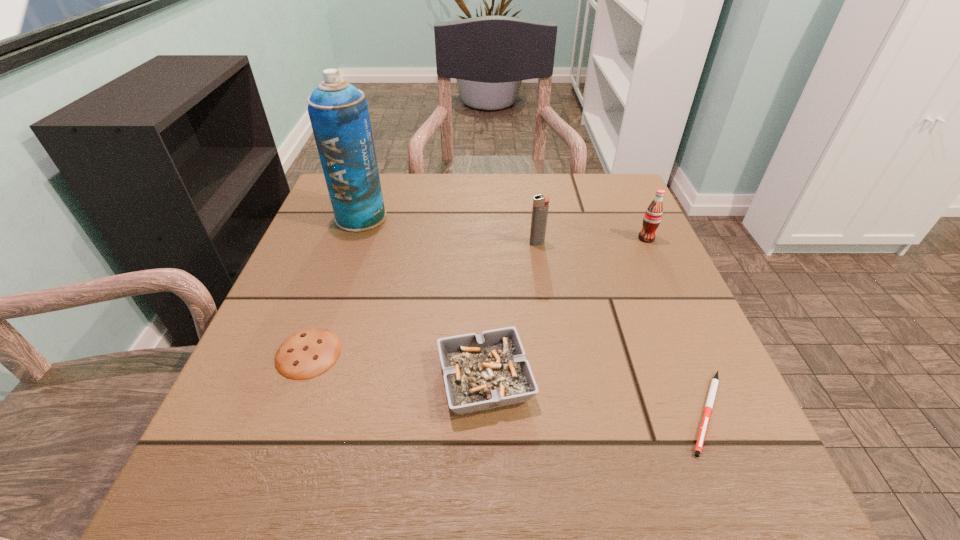
Locate an element on the screen. This screenshot has height=540, width=960. object at the far left corner is located at coordinates (x=338, y=111).

Find the location of `object present at the near right corner`. object present at the near right corner is located at coordinates (714, 384).

Where is `vacant position at the far edge of the desktop`? The width and height of the screenshot is (960, 540). vacant position at the far edge of the desktop is located at coordinates (568, 222).

Where is `vacant area at the near edge of the desktop`? vacant area at the near edge of the desktop is located at coordinates (409, 474).

Find the location of a particular element. The width and height of the screenshot is (960, 540). vacant space at the left edge is located at coordinates (362, 281).

I want to click on vacant space at the right edge of the desktop, so click(617, 330).

This screenshot has width=960, height=540. In order to click on vacant space at the near left corner of the desktop in this screenshot , I will do `click(256, 510)`.

Where is `vacant space at the far right corner of the desktop`? This screenshot has height=540, width=960. vacant space at the far right corner of the desktop is located at coordinates (588, 190).

This screenshot has height=540, width=960. I want to click on free spot at the near right corner of the desktop, so click(x=661, y=501).

At what (x,y) coordinates should I click in order to perform the action: click on blank region between the soda and the aerosol can. Please return your answer as a coordinate pair (x, y). Image resolution: width=960 pixels, height=540 pixels. Looking at the image, I should click on (504, 228).